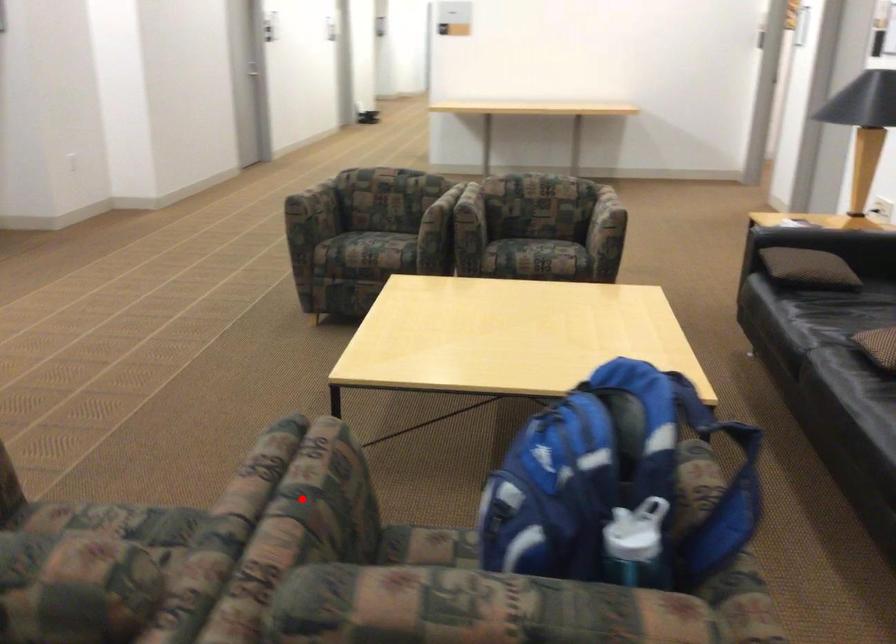
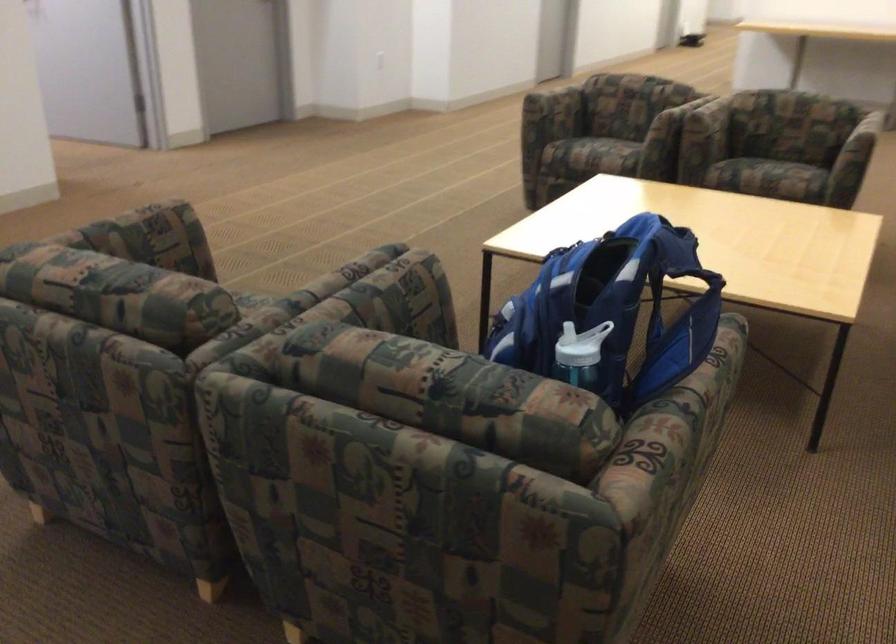
Locate, in the second image, the point that corresponds to the highlighted location in the first image.

(362, 292)